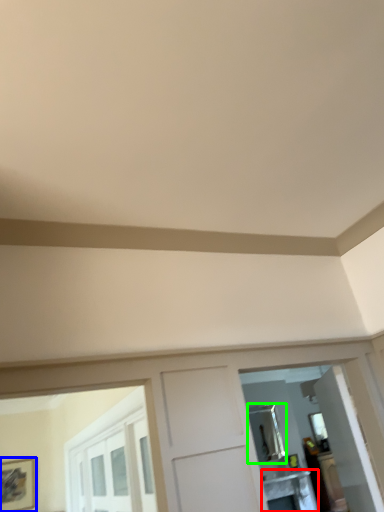
Question: Estimate the real-world distances between objects in this image. Which object is farther from table (highlighted by a red box), picture frame (highlighted by a blue box) or mirror (highlighted by a green box)?

Choices:
 (A) picture frame
 (B) mirror

Answer: (A)